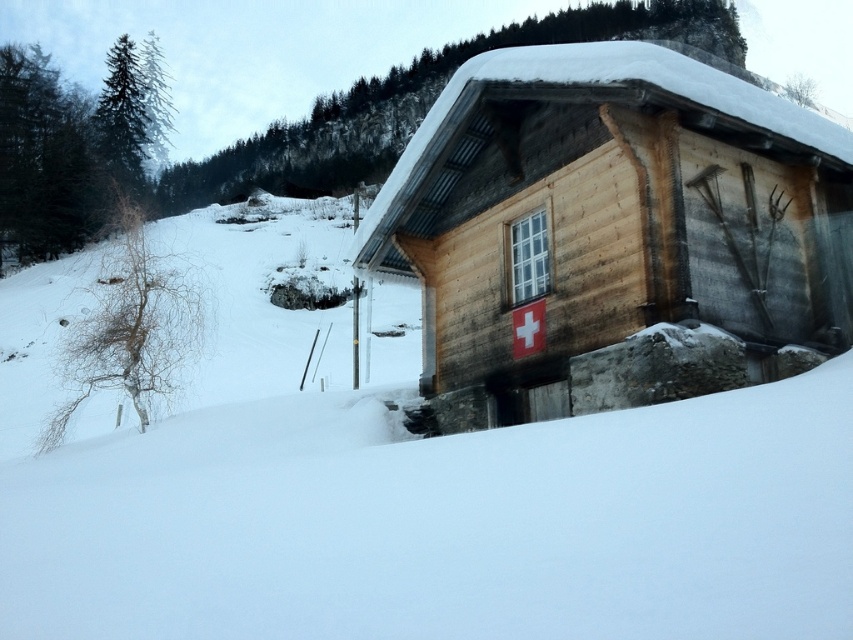
Wait, the objects are the same? Let me check the input again. Oh, the user might have made a mistake. The first object is labeled as wooden log cabin at center and the second is wooden cabin at center. They might be different. Maybe the first is a log cabin and the second is a regular wooden cabin? Hmm, but in the scene description, it says a rustic wooden cabin. Maybe they are the same object but with different labels. This could be an error. I need to proceed carefully. The question must include both as g

The wooden log cabin at center and wooden cabin at center are likely the same structure, so their height comparison is not applicable. Please verify the object labels for accuracy.

You are standing at the point marked as point (x=612, y=234). Looking around, you see the wooden log cabin at center. Based on your location, can you describe what direction the cabin is in relation to your current position?

The point (x=612, y=234) corresponds to the wooden log cabin at center, so you are standing directly at the cabin. Therefore, the cabin is right where you are standing.